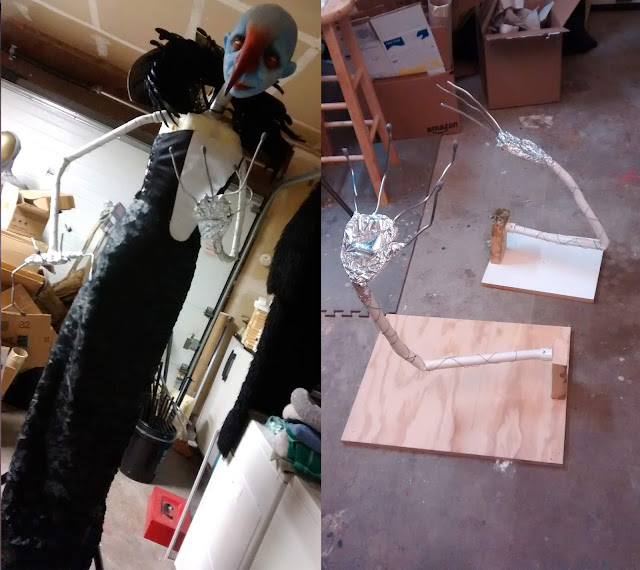
In order to click on wooden stool in this screenshot , I will do `click(339, 16)`.